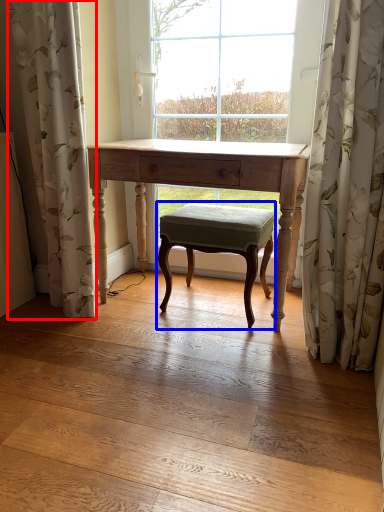
Question: Which of the following is the farthest to the observer, curtain (highlighted by a red box) or stool (highlighted by a blue box)?

Choices:
 (A) curtain
 (B) stool

Answer: (B)